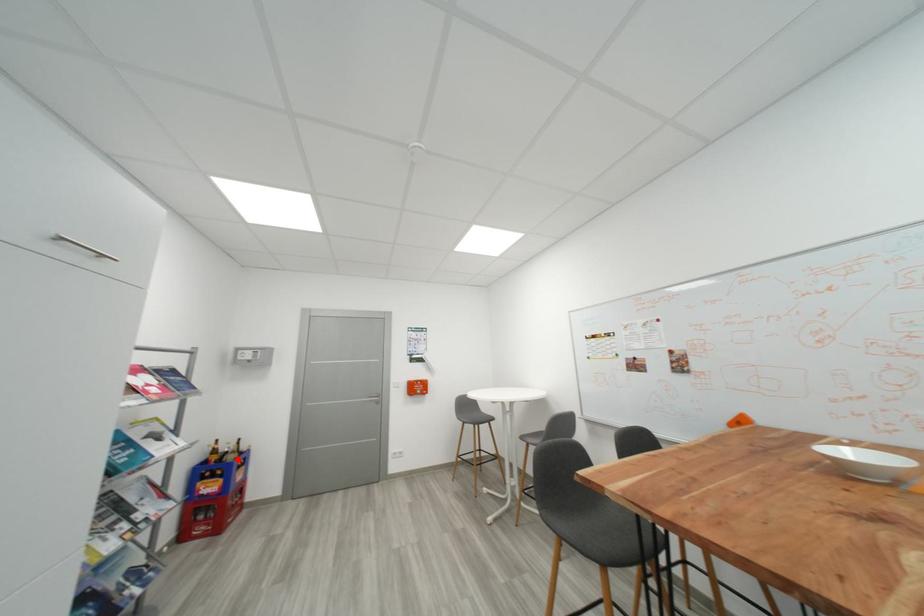
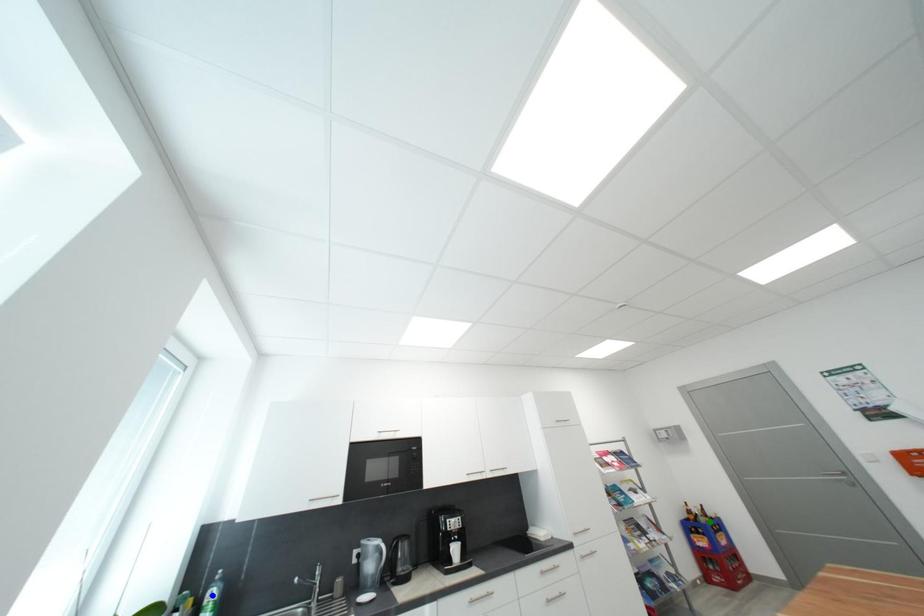
Question: I am providing you with two images of the same scene from different viewpoints. A red point is marked on the first image. You are given multiple points on the second image. Which point in image 2 represents the same 3d spot as the red point in image 1?

Choices:
 (A) yellow point
 (B) blue point
 (C) green point

Answer: (C)